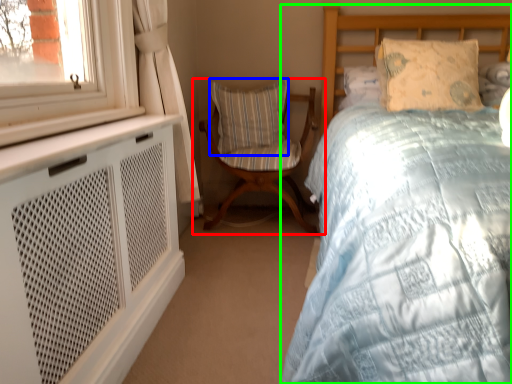
Question: Which object is the closest to the chair (highlighted by a red box)? Choose among these: pillow (highlighted by a blue box) or bed (highlighted by a green box).

Choices:
 (A) pillow
 (B) bed

Answer: (A)